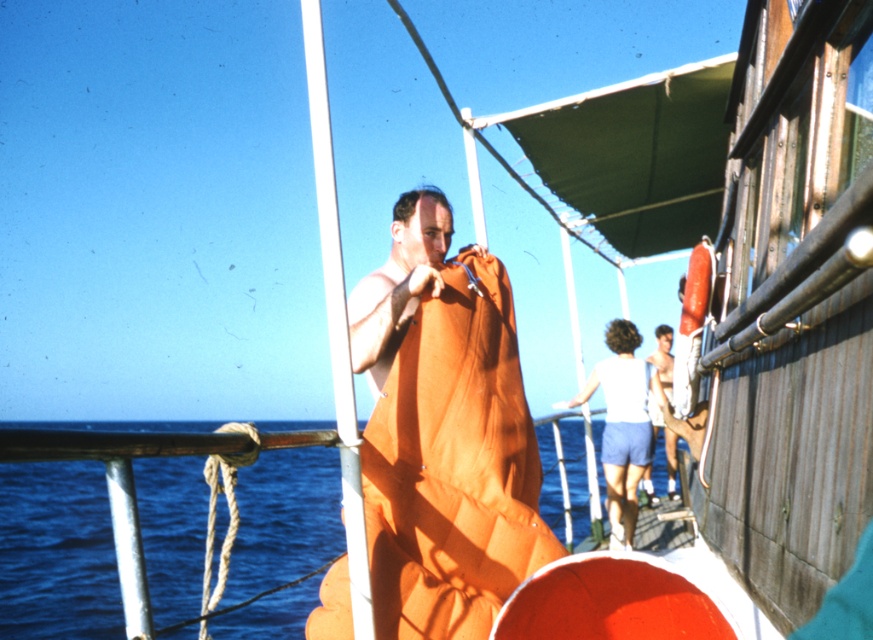
Question: Among these points, which one is nearest to the camera?

Choices:
 (A) (638, 339)
 (B) (443, 253)
 (C) (138, 499)

Answer: (B)

Question: Can you confirm if orange mesh fabric at center is smaller than white fabric at center?

Choices:
 (A) no
 (B) yes

Answer: (B)

Question: Considering the relative positions of orange mesh fabric at center and blue water at lower left in the image provided, where is orange mesh fabric at center located with respect to blue water at lower left?

Choices:
 (A) below
 (B) above

Answer: (B)

Question: Among these points, which one is farthest from the camera?

Choices:
 (A) (404, 420)
 (B) (612, 406)
 (C) (14, 470)

Answer: (C)

Question: Is orange mesh fabric at center wider than blue water at lower left?

Choices:
 (A) no
 (B) yes

Answer: (A)

Question: Which object is the farthest from the orange mesh fabric at center?

Choices:
 (A) white fabric at center
 (B) blue water at lower left

Answer: (B)